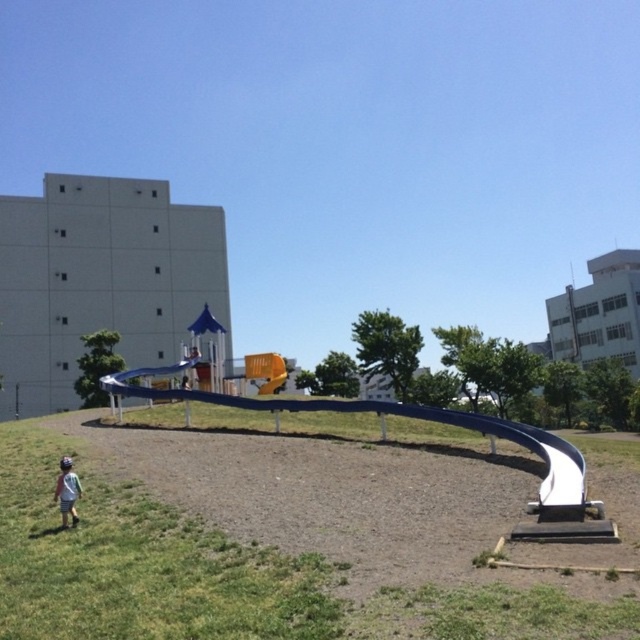
Question: Which object is positioned farthest from the green grass at lower left?

Choices:
 (A) light blue denim shorts at lower left
 (B) blue rubber slide at center

Answer: (B)

Question: Is blue rubber slide at center positioned before light blue denim shorts at lower left?

Choices:
 (A) yes
 (B) no

Answer: (A)

Question: Is green grass at lower left smaller than light blue denim shorts at lower left?

Choices:
 (A) no
 (B) yes

Answer: (A)

Question: Observing the image, what is the correct spatial positioning of green grass at lower left in reference to light blue denim shorts at lower left?

Choices:
 (A) left
 (B) right

Answer: (B)

Question: Which of the following is the closest to the observer?

Choices:
 (A) (372, 531)
 (B) (216, 397)
 (C) (72, 496)

Answer: (A)

Question: Among these objects, which one is farthest from the camera?

Choices:
 (A) green grass at lower left
 (B) light blue denim shorts at lower left
 (C) blue rubber slide at center

Answer: (B)